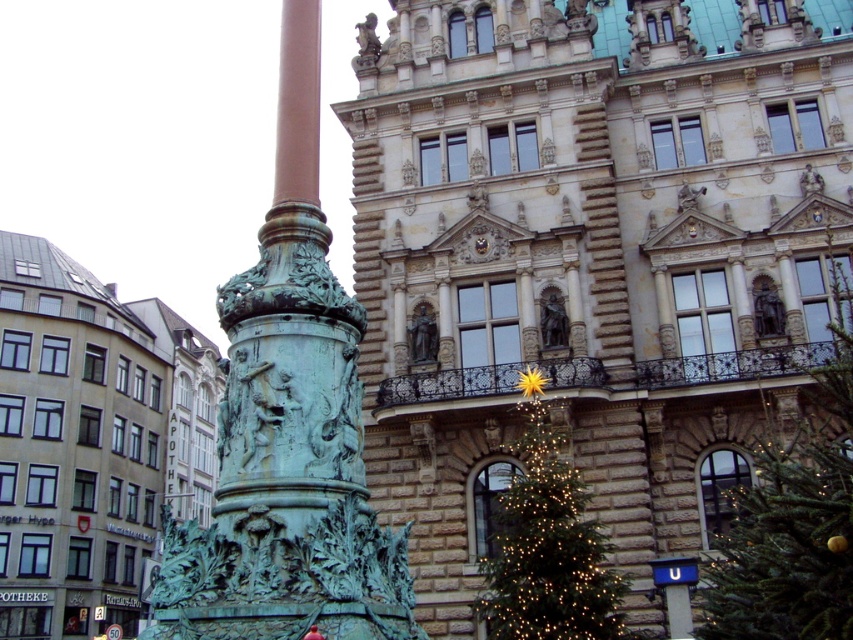
Is the position of green patina column at left less distant than that of green textured christmas tree at lower right?

Yes, green patina column at left is in front of green textured christmas tree at lower right.

Does green patina column at left lie behind green textured christmas tree at lower right?

No, green patina column at left is in front of green textured christmas tree at lower right.

I want to click on green patina column at left, so click(288, 428).

Can you confirm if green patina column at center is shorter than green textured christmas tree at lower right?

No.

Between point (450, 372) and point (596, 552), which one is positioned in front?

Point (596, 552) is in front.

Image resolution: width=853 pixels, height=640 pixels. Find the location of `green patina column at center`. green patina column at center is located at coordinates (590, 256).

Does green patina column at center have a greater width compared to green textured christmas tree at center?

Yes.

Consider the image. Can you confirm if green patina column at center is taller than green textured christmas tree at center?

Indeed, green patina column at center has a greater height compared to green textured christmas tree at center.

Which is in front, point (422, 508) or point (849, 490)?

Point (849, 490) is more forward.

Where is `green patina column at center`? This screenshot has width=853, height=640. green patina column at center is located at coordinates (590, 256).